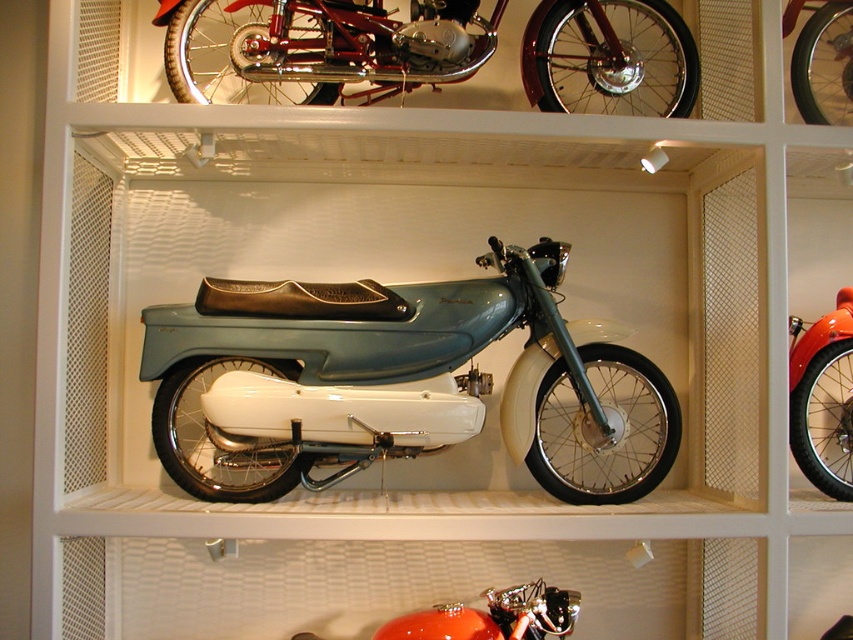
You are standing in front of the display case and want to locate the shiny red motorcycle at center. Based on the coordinates provided, where exactly is it positioned within the display case?

The shiny red motorcycle at center is located at point coordinates of 0.622 on the x axis and 0.965 on the y axis within the display case.